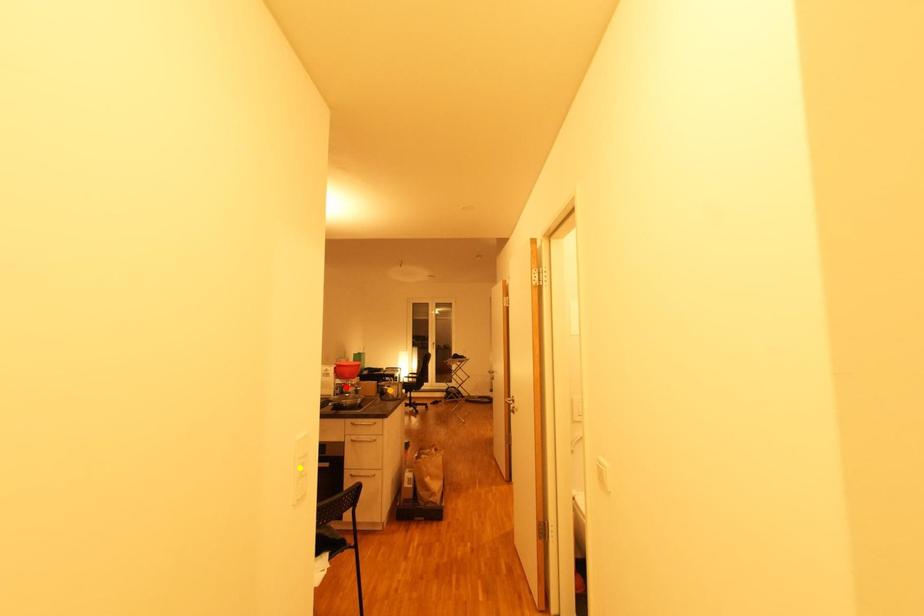
Order these from nearest to farthest:
A) yellow point
B) orange point
C) red point

yellow point < red point < orange point